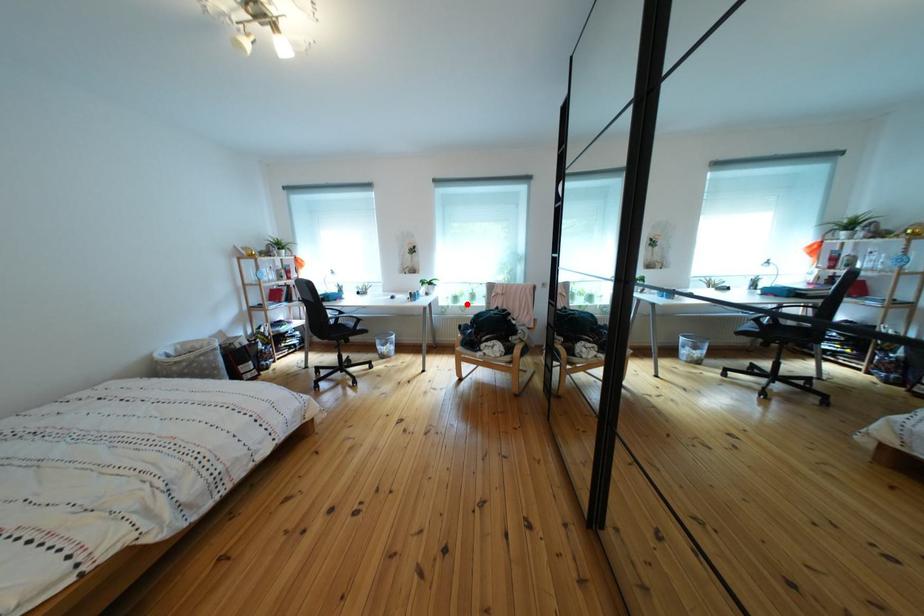
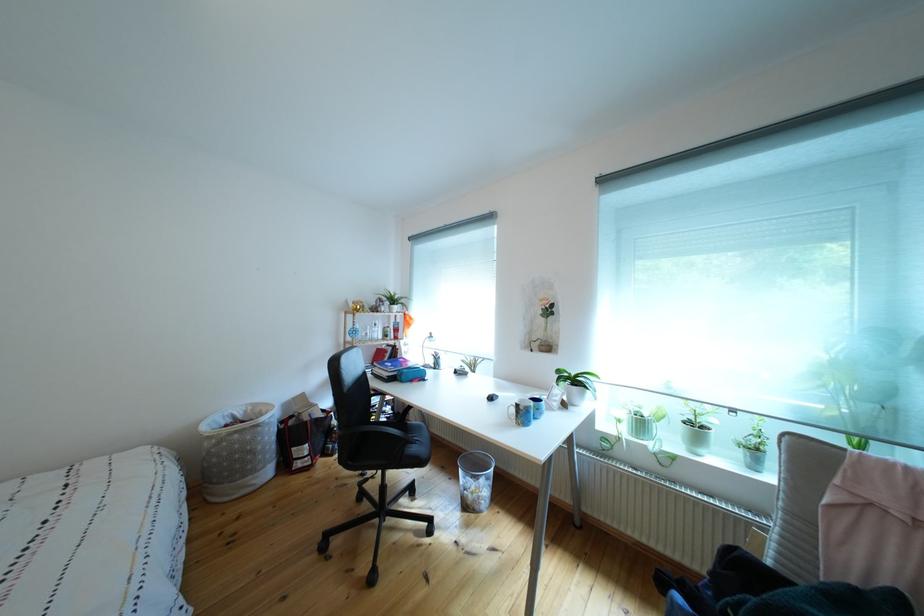
Locate, in the second image, the point that corresponds to the highlighted location in the first image.

(652, 430)